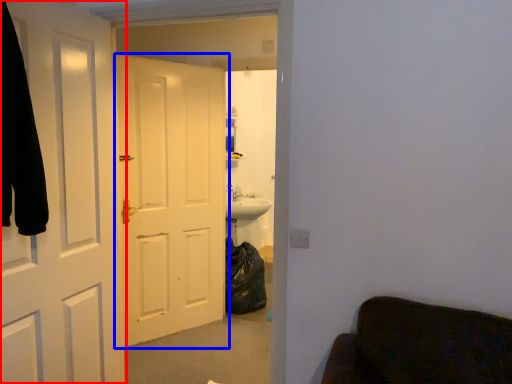
Question: Which object appears closest to the camera in this image, door (highlighted by a red box) or door (highlighted by a blue box)?

Choices:
 (A) door
 (B) door

Answer: (A)